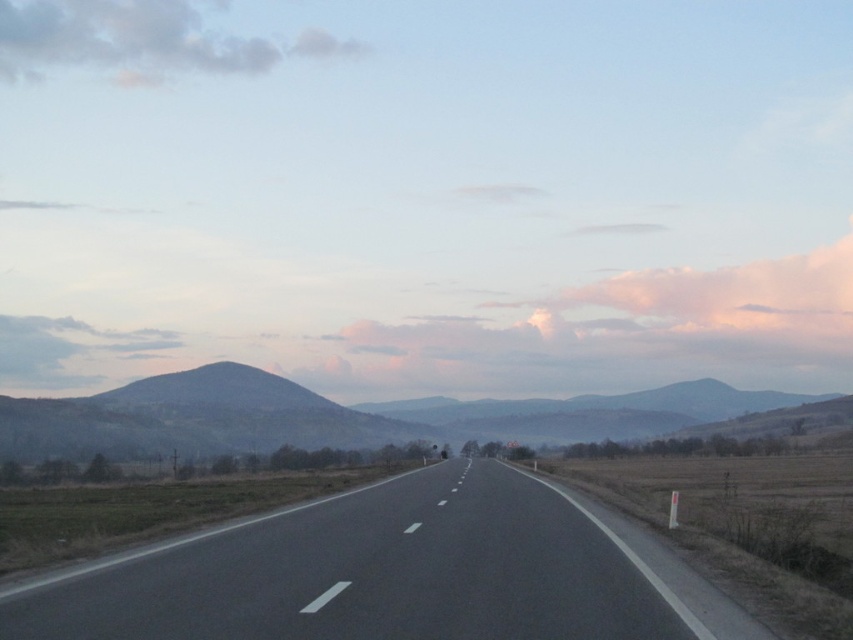
Does point (9, 614) come farther from viewer compared to point (277, 422)?

No, it is in front of (277, 422).

Find the location of a particular element. black asphalt highway at center is located at coordinates (393, 572).

The height and width of the screenshot is (640, 853). What do you see at coordinates (393, 572) in the screenshot?
I see `black asphalt highway at center` at bounding box center [393, 572].

Where is `black asphalt highway at center`? The width and height of the screenshot is (853, 640). black asphalt highway at center is located at coordinates (393, 572).

Does point (664, 628) come in front of point (143, 13)?

Yes.

Is black asphalt highway at center to the right of cloudy sky at upper left from the viewer's perspective?

Correct, you'll find black asphalt highway at center to the right of cloudy sky at upper left.

Which is behind, point (316, 604) or point (183, 17)?

The point (183, 17) is behind.

Where is `black asphalt highway at center`? Image resolution: width=853 pixels, height=640 pixels. black asphalt highway at center is located at coordinates (393, 572).

Identify the location of dark gray textured mountain at left. Image resolution: width=853 pixels, height=640 pixels. (192, 419).

Who is more forward, (239, 429) or (175, 33)?

Point (239, 429)

Is point (242, 401) positioned after point (132, 81)?

No, it is in front of (132, 81).

Image resolution: width=853 pixels, height=640 pixels. What are the coordinates of `dark gray textured mountain at left` in the screenshot? It's located at (192, 419).